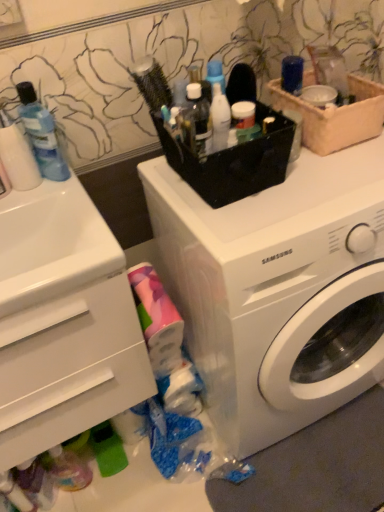
I want to click on blank space situated above white plastic washing machine at center (from a real-world perspective), so click(315, 188).